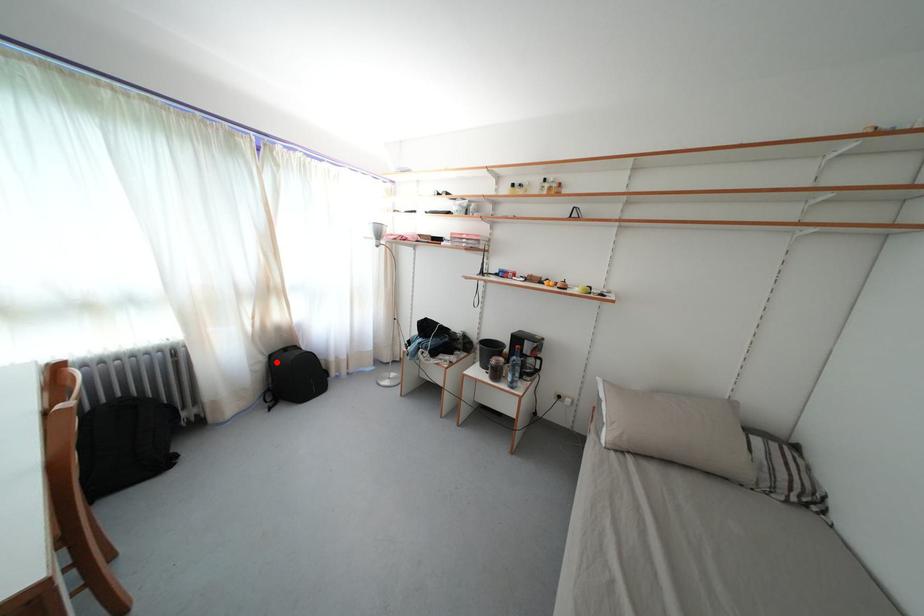
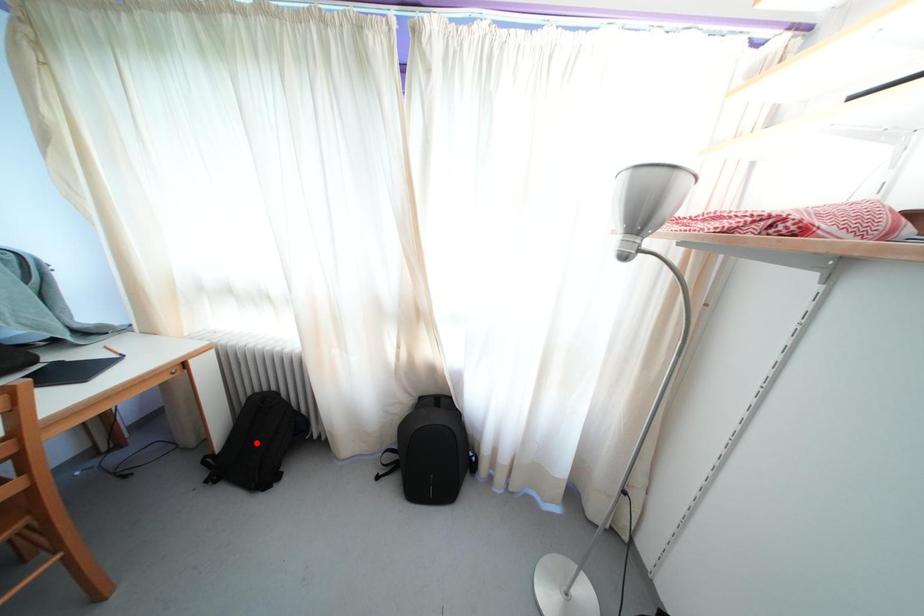
I am providing you with two images of the same scene from different viewpoints. A red point is marked on the first image and another point is marked on the second image. Do the highlighted points in image1 and image2 indicate the same real-world spot?

No